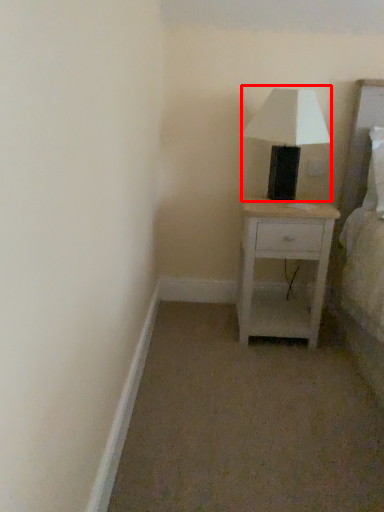
Question: In this image, where is table lamp (annotated by the red box) located relative to nightstand?

Choices:
 (A) right
 (B) left

Answer: (A)